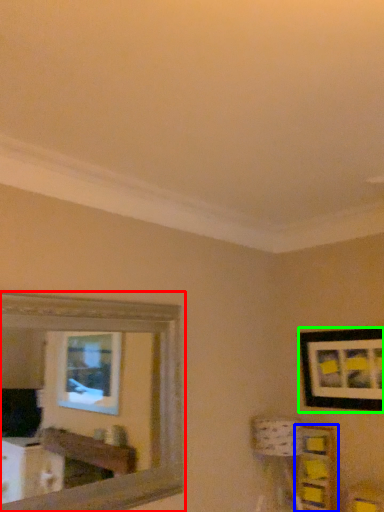
Question: Which object is the farthest from mirror (highlighted by a red box)? Choose among these: shelf (highlighted by a blue box) or picture frame (highlighted by a green box).

Choices:
 (A) shelf
 (B) picture frame

Answer: (B)